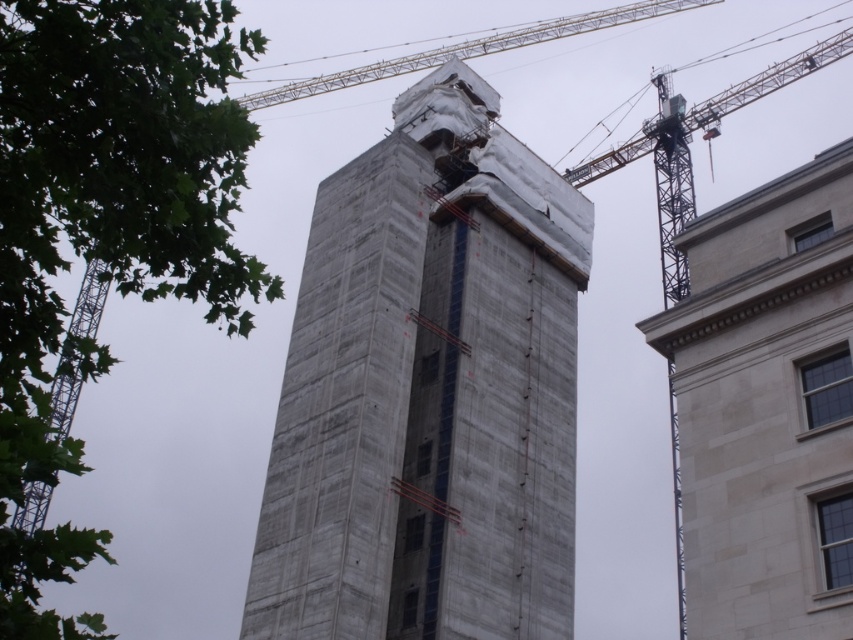
Does concrete tower at center appear on the left side of light gray stone building at right?

Yes, concrete tower at center is to the left of light gray stone building at right.

Where is `concrete tower at center`? concrete tower at center is located at coordinates (428, 390).

The image size is (853, 640). Identify the location of concrete tower at center. (428, 390).